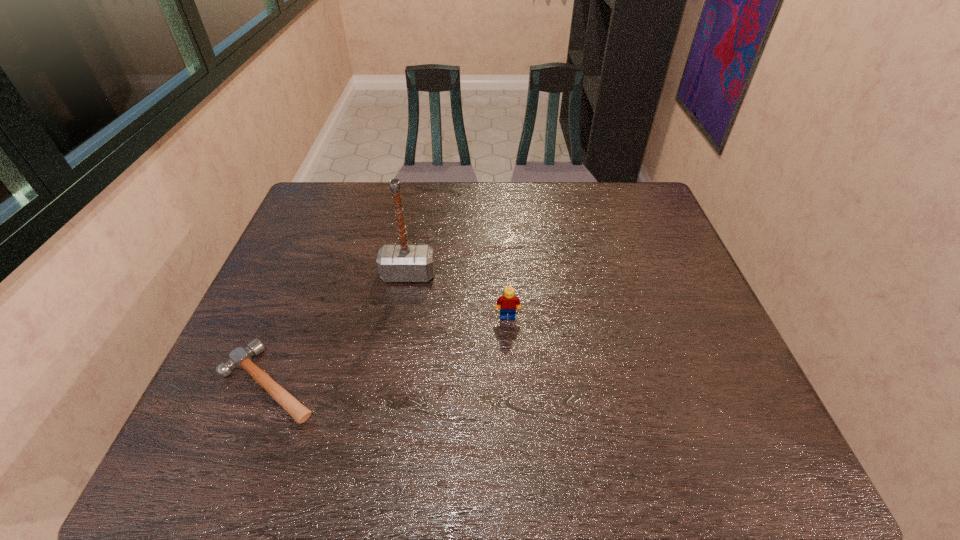
Identify the location of the farthest object. (403, 262).

Locate an element on the screen. the farther hammer is located at coordinates (403, 262).

Locate an element on the screen. The width and height of the screenshot is (960, 540). the rightmost object is located at coordinates (507, 302).

Where is `the second tallest object`? the second tallest object is located at coordinates (507, 302).

At what (x,y) coordinates should I click in order to perform the action: click on the shortest object. Please return your answer as a coordinate pair (x, y). Image resolution: width=960 pixels, height=540 pixels. Looking at the image, I should click on (241, 358).

This screenshot has width=960, height=540. What are the coordinates of `the shorter hammer` in the screenshot? It's located at (241, 358).

Find the location of `free region located on the striking surface of the second object from left to right`. free region located on the striking surface of the second object from left to right is located at coordinates (397, 338).

This screenshot has width=960, height=540. In order to click on blank space located 0.290m on the front-facing side of the rightmost object in this screenshot , I will do `click(515, 429)`.

Where is `free location located on the back of the left hammer`? free location located on the back of the left hammer is located at coordinates (303, 296).

Find the location of a particular element. The height and width of the screenshot is (540, 960). object positioned at the left edge is located at coordinates (241, 358).